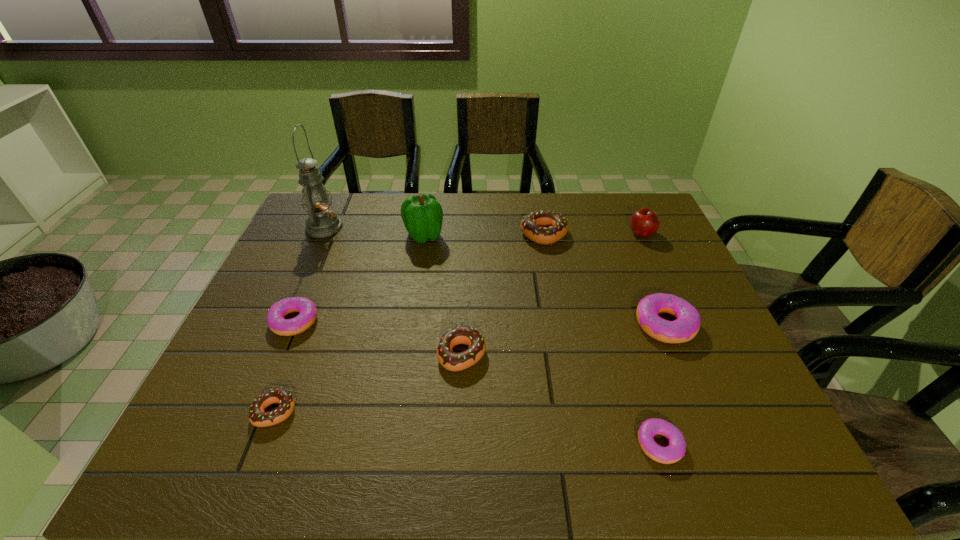
This screenshot has width=960, height=540. In order to click on the second brown doughnut from left to right in this screenshot , I will do `click(452, 361)`.

Locate an element on the screen. the second smallest pink doughnut is located at coordinates (307, 309).

Locate an element on the screen. the leftmost brown doughnut is located at coordinates click(257, 416).

Where is `the nearest brown doughnut`? the nearest brown doughnut is located at coordinates pos(257,416).

Identify the location of the shortest object. (675, 451).

Locate an element on the screen. This screenshot has width=960, height=540. the nearest pink doughnut is located at coordinates click(x=675, y=451).

What are the coordinates of `free region located on the right of the gray oil lamp` in the screenshot? It's located at (444, 227).

Find the location of `free spot located on the front of the green bell pepper`. free spot located on the front of the green bell pepper is located at coordinates (415, 293).

Locate an element on the screen. The image size is (960, 540). blank space located on the front of the pink apple is located at coordinates point(680,318).

Locate an element on the screen. The height and width of the screenshot is (540, 960). vacant space located on the right of the fourth object from right to left is located at coordinates (609, 234).